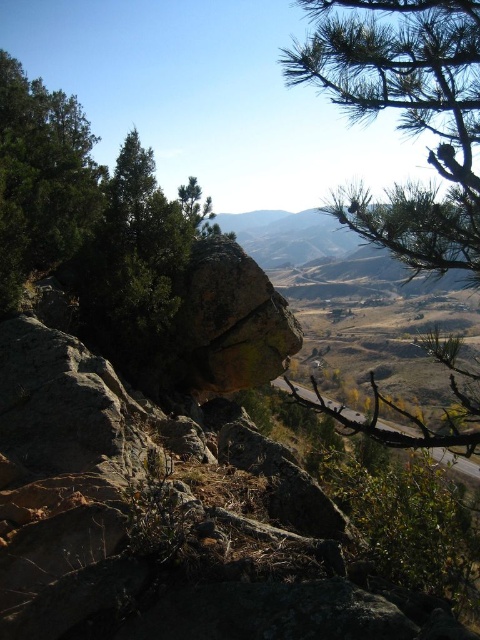
Measure the distance between point (324, 10) and camera.

A distance of 14.79 feet exists between point (324, 10) and camera.

Identify the location of green needle-like at upper right. (406, 116).